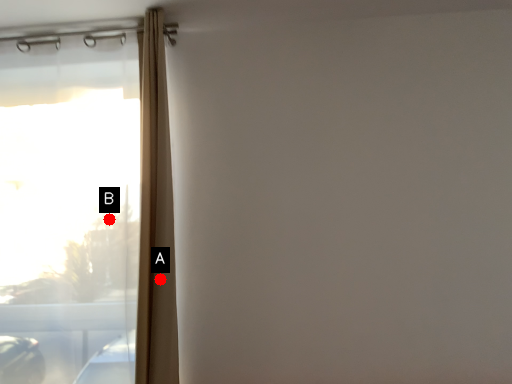
Question: Two points are circled on the image, labeled by A and B beside each circle. Which point is closer to the camera?

Choices:
 (A) A is closer
 (B) B is closer

Answer: (A)